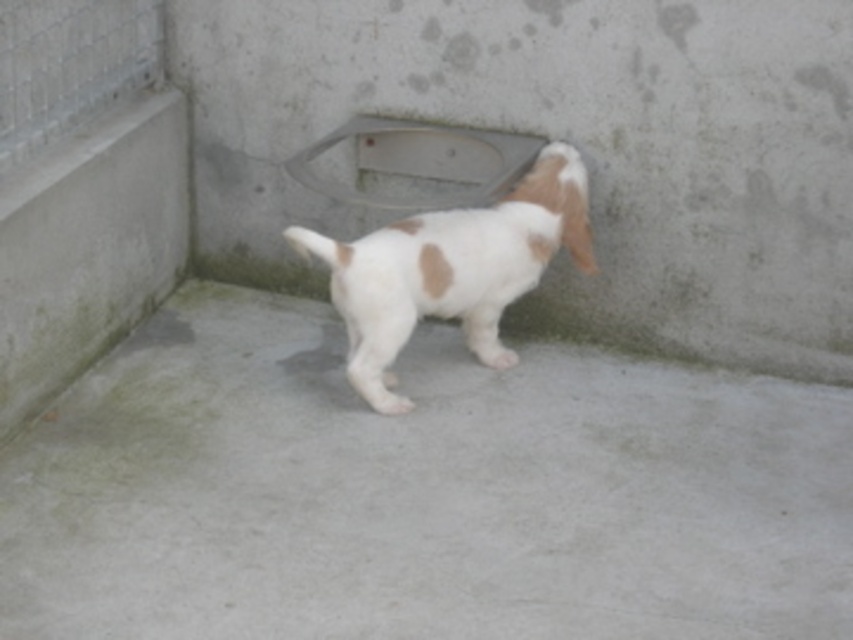
You are a maintenance worker needing to inspect the gray concrete pavement at center. You have a ladder that is 2 meters tall. Is the ladder sufficient to reach the pavement from your current position?

The distance between the gray concrete pavement at center and the viewer is 2.58 meters. Since the ladder is only 2 meters tall, it is not tall enough to reach the pavement.

You are a photographer setting up a shot of the puppy in the kennel. You need to position a light source between the two points, point [756,358] and point [450,250]. Which point should the light be closer to to ensure it illuminates the puppy effectively?

The light should be placed closer to point [450,250] because it is closer to the camera, ensuring better illumination of the puppy.

You are standing in the kennel area and see the point at coordinates (418, 492). What is the material of the surface at that point?

The gray concrete pavement at center is represented by point (418, 492), so the material is concrete.